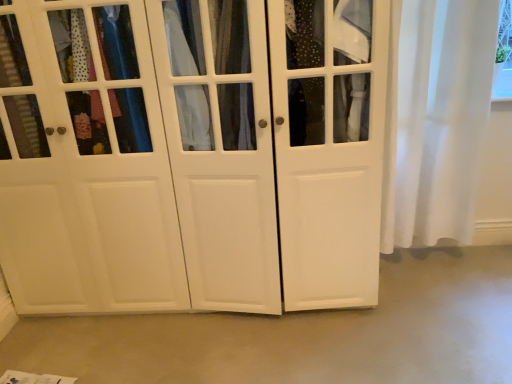
Question: Does smooth concrete floor at center turn towards white matte cabinet at center?

Choices:
 (A) yes
 (B) no

Answer: (B)

Question: From a real-world perspective, is smooth concrete floor at center located higher than white matte cabinet at center?

Choices:
 (A) no
 (B) yes

Answer: (A)

Question: Can we say smooth concrete floor at center lies outside white matte cabinet at center?

Choices:
 (A) yes
 (B) no

Answer: (A)

Question: Is white matte cabinet at center at the back of smooth concrete floor at center?

Choices:
 (A) no
 (B) yes

Answer: (A)

Question: Does smooth concrete floor at center appear on the left side of white matte cabinet at center?

Choices:
 (A) yes
 (B) no

Answer: (B)

Question: Is smooth concrete floor at center behind white matte cabinet at center?

Choices:
 (A) yes
 (B) no

Answer: (A)

Question: Could you tell me if white sheer curtain at right is facing smooth concrete floor at center?

Choices:
 (A) no
 (B) yes

Answer: (A)

Question: From the image's perspective, is white sheer curtain at right beneath smooth concrete floor at center?

Choices:
 (A) yes
 (B) no

Answer: (B)

Question: From a real-world perspective, does white sheer curtain at right sit lower than smooth concrete floor at center?

Choices:
 (A) yes
 (B) no

Answer: (B)

Question: Can you confirm if white sheer curtain at right is positioned to the left of smooth concrete floor at center?

Choices:
 (A) no
 (B) yes

Answer: (A)

Question: From a real-world perspective, is white sheer curtain at right over smooth concrete floor at center?

Choices:
 (A) yes
 (B) no

Answer: (A)

Question: Considering the relative sizes of white sheer curtain at right and smooth concrete floor at center in the image provided, is white sheer curtain at right thinner than smooth concrete floor at center?

Choices:
 (A) no
 (B) yes

Answer: (B)

Question: From the image's perspective, is smooth concrete floor at center on white sheer curtain at right?

Choices:
 (A) no
 (B) yes

Answer: (A)